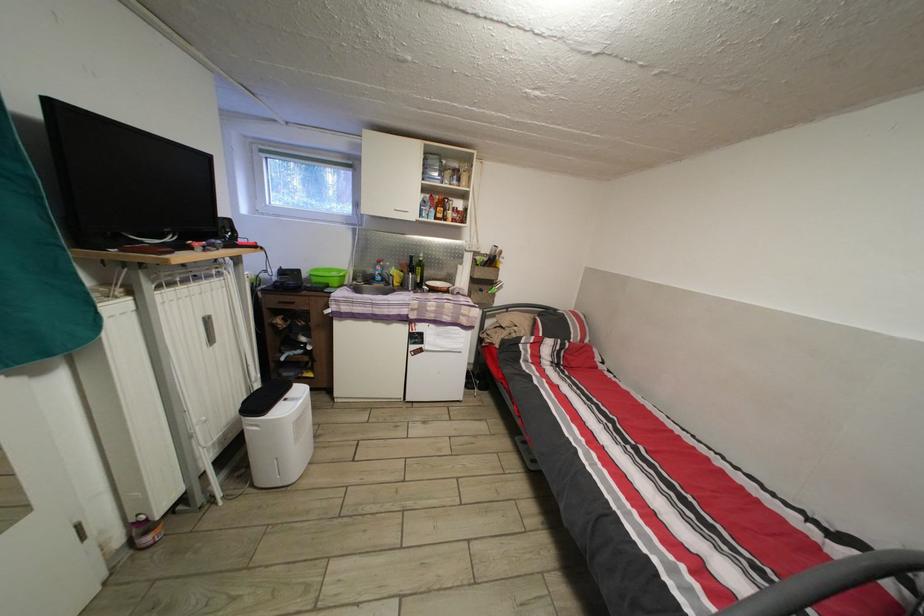
The width and height of the screenshot is (924, 616). In order to click on metal cabinet handle in this screenshot , I will do `click(417, 183)`.